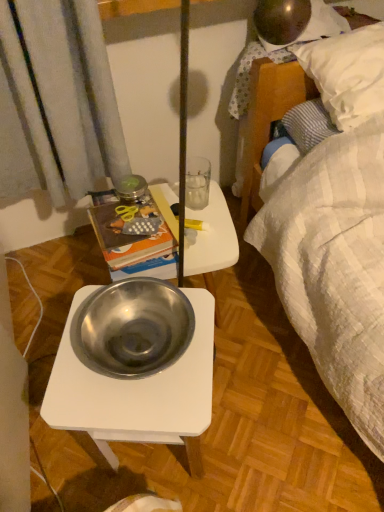
This screenshot has height=512, width=384. I want to click on free location to the right of metallic silver bowl at center, so click(x=260, y=307).